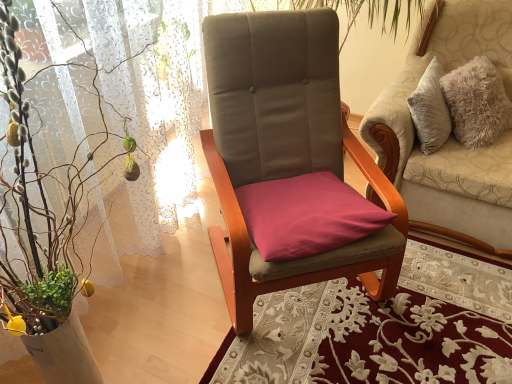
At what (x,y) coordinates should I click in order to perform the action: click on vacant area that lies to the right of suede-like beige chair at center, marked as the second chair in a right-to-left arrangement. Please return your answer as a coordinate pair (x, y). The image size is (512, 384). Looking at the image, I should click on (447, 305).